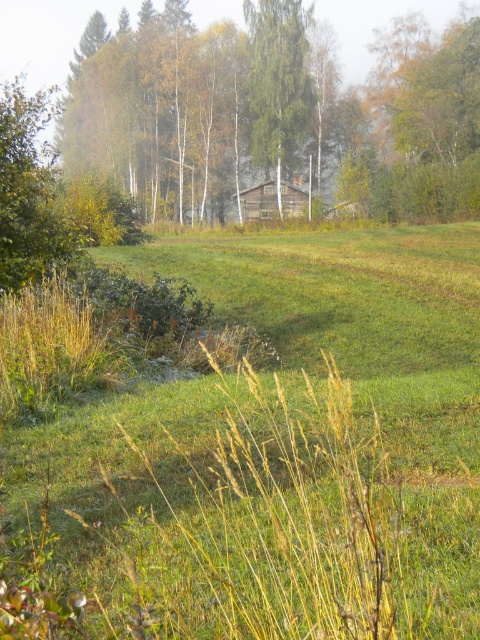
Question: In this image, where is green grassy pasture at center located relative to green wood house at center?

Choices:
 (A) right
 (B) left

Answer: (A)

Question: Observing the image, what is the correct spatial positioning of green grassy pasture at center in reference to wooden cabin at center?

Choices:
 (A) right
 (B) left

Answer: (B)

Question: Which point is farther from the camera taking this photo?

Choices:
 (A) (298, 81)
 (B) (434, 529)
 (C) (291, 202)
 (D) (238, 168)

Answer: (D)

Question: Which of the following is the farthest from the observer?

Choices:
 (A) green grassy pasture at center
 (B) green wood house at center

Answer: (B)

Question: Can you confirm if white bark birch tree at center is positioned above wooden cabin at center?

Choices:
 (A) yes
 (B) no

Answer: (A)

Question: Which of the following is the farthest from the observer?

Choices:
 (A) white bark birch tree at center
 (B) green grassy pasture at center
 (C) green wood house at center

Answer: (A)